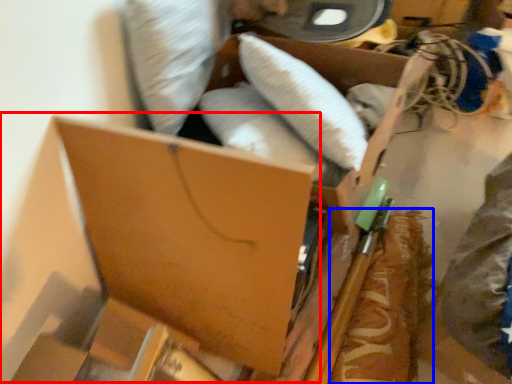
Question: Which object appears closest to the camera in this image, storage box (highlighted by a red box) or food (highlighted by a blue box)?

Choices:
 (A) storage box
 (B) food

Answer: (A)